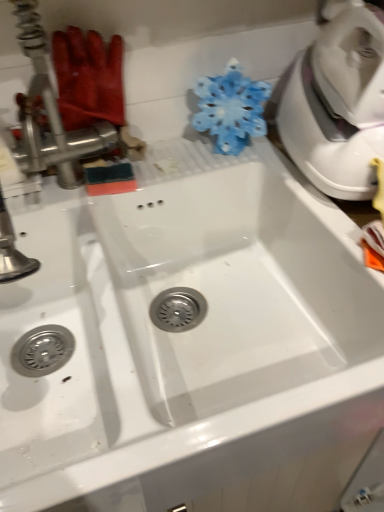
Question: Considering the relative positions of translucent plastic snowflake at upper center and metallic silver faucet at upper left in the image provided, is translucent plastic snowflake at upper center behind metallic silver faucet at upper left?

Choices:
 (A) yes
 (B) no

Answer: (A)

Question: Is metallic silver faucet at upper left at the back of translucent plastic snowflake at upper center?

Choices:
 (A) no
 (B) yes

Answer: (A)

Question: Is metallic silver faucet at upper left a part of translucent plastic snowflake at upper center?

Choices:
 (A) no
 (B) yes

Answer: (A)

Question: Can you confirm if translucent plastic snowflake at upper center is positioned to the right of metallic silver faucet at upper left?

Choices:
 (A) yes
 (B) no

Answer: (A)

Question: Is translucent plastic snowflake at upper center wider than metallic silver faucet at upper left?

Choices:
 (A) yes
 (B) no

Answer: (A)

Question: Is translucent plastic snowflake at upper center completely or partially outside of metallic silver faucet at upper left?

Choices:
 (A) yes
 (B) no

Answer: (A)

Question: Is metallic silver faucet at upper left completely or partially outside of translucent plastic snowflake at upper center?

Choices:
 (A) no
 (B) yes

Answer: (B)

Question: From a real-world perspective, is metallic silver faucet at upper left positioned under translucent plastic snowflake at upper center based on gravity?

Choices:
 (A) yes
 (B) no

Answer: (B)

Question: Is metallic silver faucet at upper left with translucent plastic snowflake at upper center?

Choices:
 (A) no
 (B) yes

Answer: (A)

Question: Is metallic silver faucet at upper left smaller than translucent plastic snowflake at upper center?

Choices:
 (A) no
 (B) yes

Answer: (B)

Question: Is metallic silver faucet at upper left further to the viewer compared to translucent plastic snowflake at upper center?

Choices:
 (A) yes
 (B) no

Answer: (B)

Question: Is metallic silver faucet at upper left turned away from translucent plastic snowflake at upper center?

Choices:
 (A) yes
 (B) no

Answer: (B)

Question: Is metallic silver faucet at upper left wider or thinner than translucent plastic snowflake at upper center?

Choices:
 (A) thin
 (B) wide

Answer: (A)